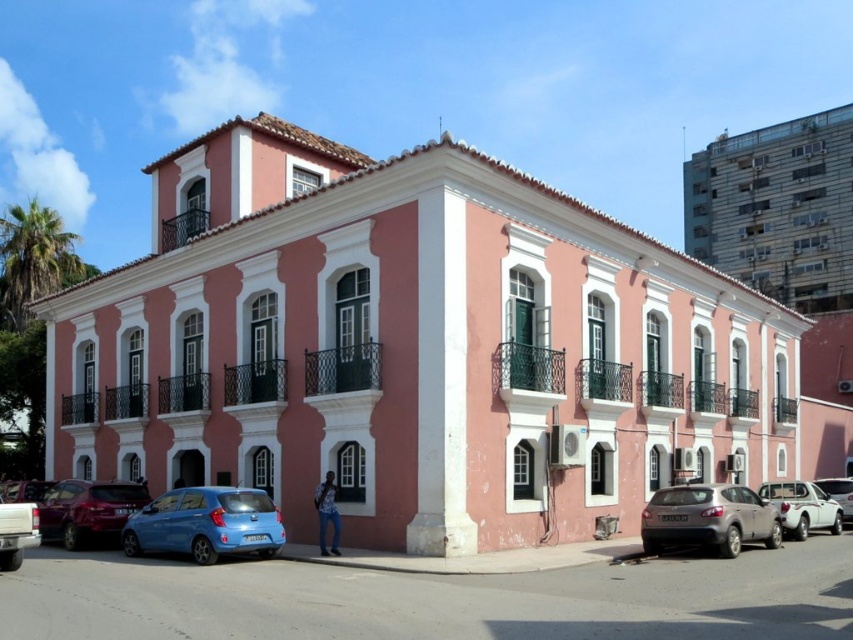
Which is behind, point (752, 522) or point (136, 506)?

Point (136, 506)

What do you see at coordinates (708, 518) in the screenshot? This screenshot has height=640, width=853. I see `satin silver suv at lower right` at bounding box center [708, 518].

Is point (650, 524) positioned behind point (102, 504)?

No, (650, 524) is closer to viewer.

Identify the location of satin silver suv at lower right. The width and height of the screenshot is (853, 640). (708, 518).

Between satin silver suv at lower right and white glossy sedan at center, which one is positioned lower?

white glossy sedan at center is lower down.

Is point (659, 528) farther from viewer compared to point (843, 506)?

No.

Is point (746, 531) farther from viewer compared to point (846, 484)?

No, it is not.

The width and height of the screenshot is (853, 640). I want to click on satin silver suv at lower right, so click(x=708, y=518).

Which is in front, point (691, 518) or point (6, 544)?

Point (6, 544)

I want to click on satin silver suv at lower right, so click(x=708, y=518).